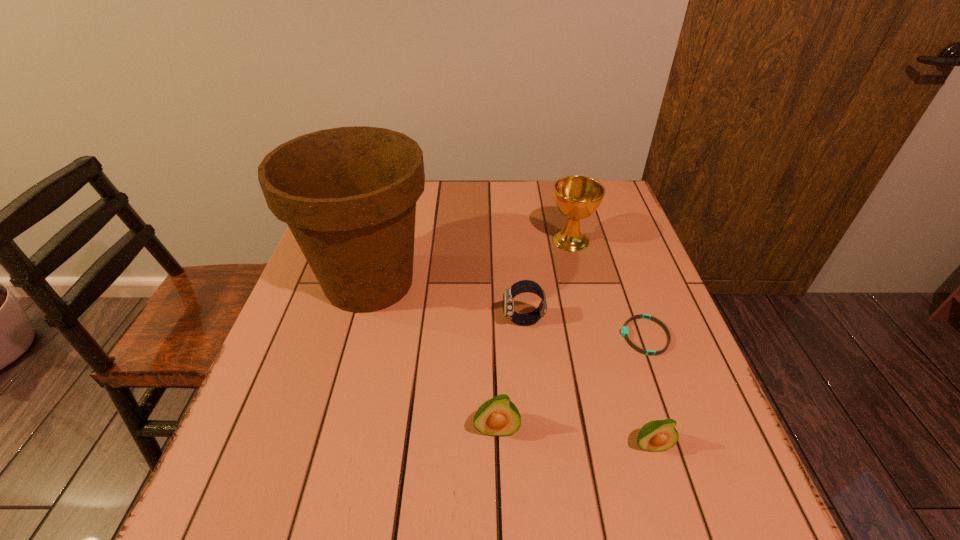
Locate an element on the screen. This screenshot has width=960, height=540. the left avocado is located at coordinates (498, 416).

Where is `the shorter avocado`? The width and height of the screenshot is (960, 540). the shorter avocado is located at coordinates (659, 435).

Find the location of a particular element. chalice is located at coordinates (577, 197).

Where is `flowerpot`? The image size is (960, 540). flowerpot is located at coordinates (348, 194).

Image resolution: width=960 pixels, height=540 pixels. I want to click on the tallest object, so click(x=348, y=194).

At what (x,y) coordinates should I click in order to perform the action: click on watch. Please return your answer as a coordinate pair (x, y). The image size is (960, 540). Looking at the image, I should click on (523, 286).

Find the location of a particular element. The width and height of the screenshot is (960, 540). the shortest object is located at coordinates (624, 331).

Locate an element on the screen. vacant space located on the back of the second tallest object is located at coordinates (559, 194).

Image resolution: width=960 pixels, height=540 pixels. Identify the location of free region located 0.090m on the back of the leftmost object. (385, 224).

Where is `blank area located on the face of the watch`? The image size is (960, 540). blank area located on the face of the watch is located at coordinates (481, 321).